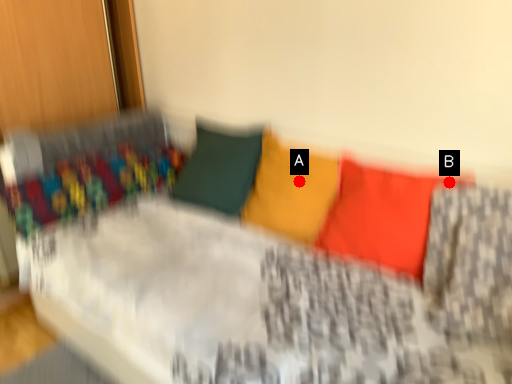
Question: Two points are circled on the image, labeled by A and B beside each circle. Which point is farther from the camera taking this photo?

Choices:
 (A) A is further
 (B) B is further

Answer: (A)